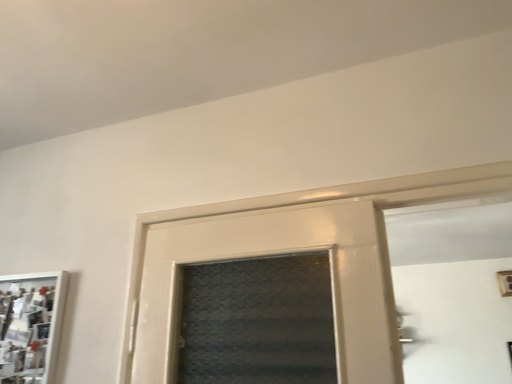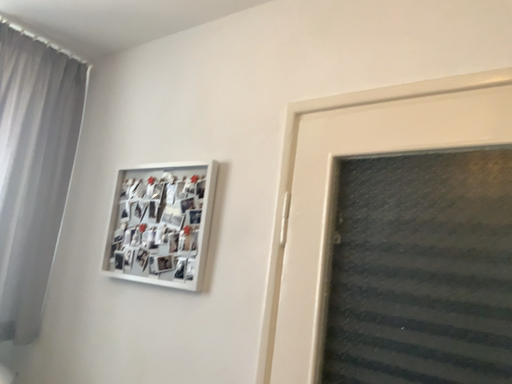
Question: Which way did the camera rotate in the video?

Choices:
 (A) rotated right
 (B) rotated left

Answer: (B)